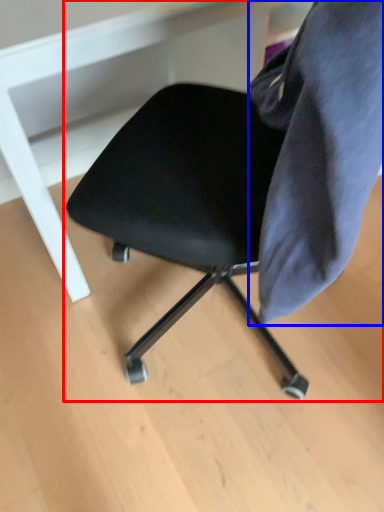
Question: Which point is closer to the camera, chair (highlighted by a red box) or fabric (highlighted by a blue box)?

Choices:
 (A) chair
 (B) fabric

Answer: (A)